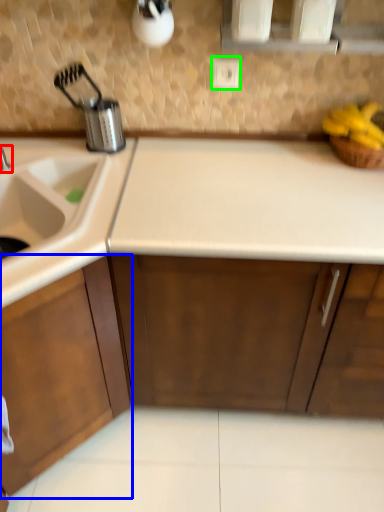
Question: Which object is the farthest from tap (highlighted by a red box)? Choose among these: cabinetry (highlighted by a blue box) or electric outlet (highlighted by a green box).

Choices:
 (A) cabinetry
 (B) electric outlet

Answer: (B)